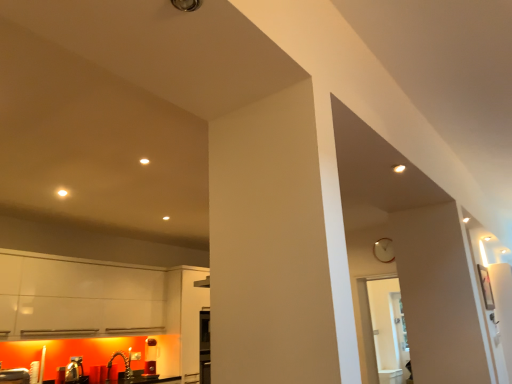
Question: Would you say wooden clock at upper right is a long distance from transparent glass door at center?

Choices:
 (A) no
 (B) yes

Answer: (A)

Question: Does wooden clock at upper right come in front of transparent glass door at center?

Choices:
 (A) no
 (B) yes

Answer: (A)

Question: Is wooden clock at upper right next to transparent glass door at center and touching it?

Choices:
 (A) yes
 (B) no

Answer: (B)

Question: Can you confirm if wooden clock at upper right is thinner than transparent glass door at center?

Choices:
 (A) no
 (B) yes

Answer: (B)

Question: From a real-world perspective, is wooden clock at upper right positioned under transparent glass door at center based on gravity?

Choices:
 (A) yes
 (B) no

Answer: (B)

Question: Is wooden clock at upper right at the left side of transparent glass door at center?

Choices:
 (A) yes
 (B) no

Answer: (B)

Question: Is transparent glass door at center to the left of brushed metal sink at lower left from the viewer's perspective?

Choices:
 (A) yes
 (B) no

Answer: (B)

Question: From the image's perspective, is transparent glass door at center below brushed metal sink at lower left?

Choices:
 (A) no
 (B) yes

Answer: (A)

Question: Considering the relative sizes of transparent glass door at center and brushed metal sink at lower left in the image provided, is transparent glass door at center thinner than brushed metal sink at lower left?

Choices:
 (A) no
 (B) yes

Answer: (A)

Question: From the image's perspective, is transparent glass door at center on top of brushed metal sink at lower left?

Choices:
 (A) yes
 (B) no

Answer: (A)

Question: From a real-world perspective, is transparent glass door at center beneath brushed metal sink at lower left?

Choices:
 (A) no
 (B) yes

Answer: (A)

Question: Is transparent glass door at center next to brushed metal sink at lower left and touching it?

Choices:
 (A) no
 (B) yes

Answer: (A)

Question: Is wooden clock at upper right far away from brushed metal sink at lower left?

Choices:
 (A) yes
 (B) no

Answer: (A)